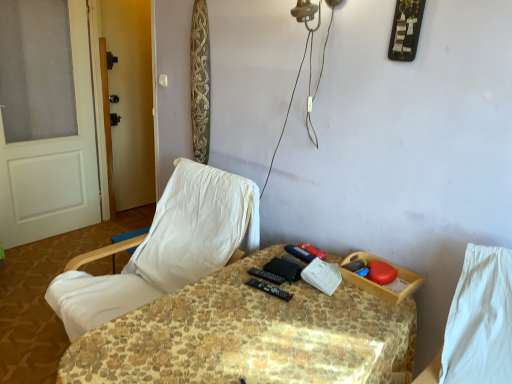
The image size is (512, 384). What do you see at coordinates (57, 156) in the screenshot?
I see `white painted wood door at left` at bounding box center [57, 156].

What do you see at coordinates (130, 99) in the screenshot? Image resolution: width=512 pixels, height=384 pixels. I see `transparent glass screen door at left` at bounding box center [130, 99].

What do you see at coordinates (250, 336) in the screenshot? I see `patterned fabric table at center` at bounding box center [250, 336].

What is the approximate height of white fabric chair at left?

white fabric chair at left is 37.01 inches in height.

The width and height of the screenshot is (512, 384). I want to click on white painted wood door at left, so click(57, 156).

Is white painted wood door at left inside the boundaries of transparent glass screen door at left, or outside?

white painted wood door at left is not enclosed by transparent glass screen door at left.

Which is in front, point (11, 234) or point (125, 21)?

Point (11, 234)

From the picture: Between white painted wood door at left and transparent glass screen door at left, which one has less height?

white painted wood door at left.

Does white painted wood door at left have a greater width compared to transparent glass screen door at left?

In fact, white painted wood door at left might be narrower than transparent glass screen door at left.

From the image's perspective, relative to patterned fabric table at center, is black plastic remote control at center above or below?

Based on their image positions, black plastic remote control at center is located above patterned fabric table at center.

Does black plastic remote control at center have a greater width compared to patterned fabric table at center?

No, black plastic remote control at center is not wider than patterned fabric table at center.

Can you confirm if black plastic remote control at center is taller than patterned fabric table at center?

Incorrect, the height of black plastic remote control at center is not larger of that of patterned fabric table at center.

Is point (249, 283) closer or farther from the camera than point (114, 337)?

Clearly, point (249, 283) is more distant from the camera than point (114, 337).

Does white fabric chair at left come in front of patterned fabric table at center?

No, white fabric chair at left is further to the viewer.

Find the location of a particular element. This screenshot has height=384, width=512. chair lying above the patterned fabric table at center (from the image's perspective) is located at coordinates (166, 248).

From the image's perspective, between white fabric chair at left and patterned fabric table at center, who is located below?

From the image's view, patterned fabric table at center is below.

Considering the positions of objects white fabric chair at left and patterned fabric table at center in the image provided, who is more to the right, white fabric chair at left or patterned fabric table at center?

patterned fabric table at center.

In terms of width, does patterned fabric table at center look wider or thinner when compared to transparent glass screen door at left?

In the image, patterned fabric table at center appears to be wider than transparent glass screen door at left.

Who is more distant, patterned fabric table at center or transparent glass screen door at left?

transparent glass screen door at left is further from the camera.

Is patterned fabric table at center directly adjacent to transparent glass screen door at left?

patterned fabric table at center and transparent glass screen door at left are clearly separated.

Is patterned fabric table at center oriented towards transparent glass screen door at left?

No.

From the image's perspective, which is below, white fabric chair at left or transparent glass screen door at left?

white fabric chair at left appears lower in the image.

Is point (187, 255) less distant than point (153, 157)?

Yes.

Is white fabric chair at left bigger than transparent glass screen door at left?

Yes.

Locate an element on the screen. This screenshot has height=384, width=512. screen door behind the white fabric chair at left is located at coordinates (130, 99).

Based on the photo, is black plastic remote control at center positioned with its back to white painted wood door at left?

No.

Based on the photo, is black plastic remote control at center smaller than white painted wood door at left?

Yes.

Is black plastic remote control at center at the right side of white painted wood door at left?

Indeed, black plastic remote control at center is positioned on the right side of white painted wood door at left.

Is the depth of black plastic remote control at center less than that of white painted wood door at left?

Yes, the depth of black plastic remote control at center is less than that of white painted wood door at left.

From the image's perspective, is white painted wood door at left above or below black plastic remote control at center?

white painted wood door at left is situated higher than black plastic remote control at center in the image.

From their relative heights in the image, would you say white painted wood door at left is taller or shorter than black plastic remote control at center?

Clearly, white painted wood door at left is taller compared to black plastic remote control at center.

Considering the relative sizes of white painted wood door at left and black plastic remote control at center in the image provided, is white painted wood door at left thinner than black plastic remote control at center?

In fact, white painted wood door at left might be wider than black plastic remote control at center.

Considering the positions of objects white painted wood door at left and black plastic remote control at center in the image provided, who is in front, white painted wood door at left or black plastic remote control at center?

Positioned in front is black plastic remote control at center.

Locate an element on the screen. door below the transparent glass screen door at left (from a real-world perspective) is located at coordinates (57, 156).

Locate an element on the screen. equipment on the right of patterned fabric table at center is located at coordinates (270, 289).

Based on the photo, from the image, which object appears to be nearer to transparent glass screen door at left, black plastic remote control at center or white painted wood door at left?

white painted wood door at left is positioned closer to the anchor transparent glass screen door at left.

Considering their positions, is patterned fabric table at center positioned further to white fabric chair at left than black plastic remote control at center?

black plastic remote control at center is further to white fabric chair at left.

Estimate the real-world distances between objects in this image. Which object is further from black plastic remote control at center, transparent glass screen door at left or white fabric chair at left?

transparent glass screen door at left is further to black plastic remote control at center.

Considering their positions, is white fabric chair at left positioned further to patterned fabric table at center than white painted wood door at left?

white painted wood door at left is positioned further to the anchor patterned fabric table at center.

Estimate the real-world distances between objects in this image. Which object is further from white fabric chair at left, patterned fabric table at center or transparent glass screen door at left?

transparent glass screen door at left lies further to white fabric chair at left than the other object.

When comparing their distances from white painted wood door at left, does transparent glass screen door at left or black plastic remote control at center seem closer?

transparent glass screen door at left is closer to white painted wood door at left.

Which object lies further to the anchor point black plastic remote control at center, white painted wood door at left or patterned fabric table at center?

white painted wood door at left is positioned further to the anchor black plastic remote control at center.

From the picture: From the image, which object appears to be farther from transparent glass screen door at left, white fabric chair at left or white painted wood door at left?

Among the two, white fabric chair at left is located further to transparent glass screen door at left.

At what (x,y) coordinates should I click in order to perform the action: click on door between patterned fabric table at center and transparent glass screen door at left from front to back. Please return your answer as a coordinate pair (x, y). Looking at the image, I should click on (57, 156).

Locate an element on the screen. screen door situated between white painted wood door at left and black plastic remote control at center from left to right is located at coordinates [130, 99].

Identify the location of chair between patterned fabric table at center and transparent glass screen door at left along the z-axis. (166, 248).

Where is `chair positioned between patterned fabric table at center and white painted wood door at left from near to far`? The image size is (512, 384). chair positioned between patterned fabric table at center and white painted wood door at left from near to far is located at coordinates [x=166, y=248].